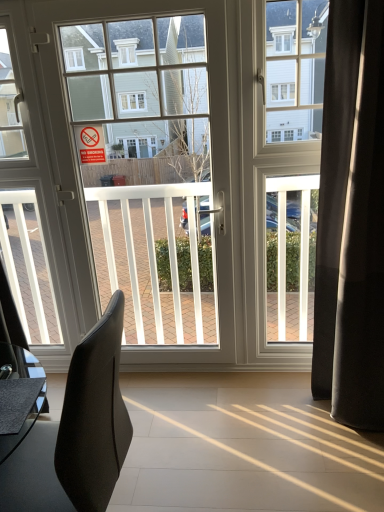
Where is `vacant area to the right of white glossy door at center`? This screenshot has width=384, height=512. vacant area to the right of white glossy door at center is located at coordinates (248, 395).